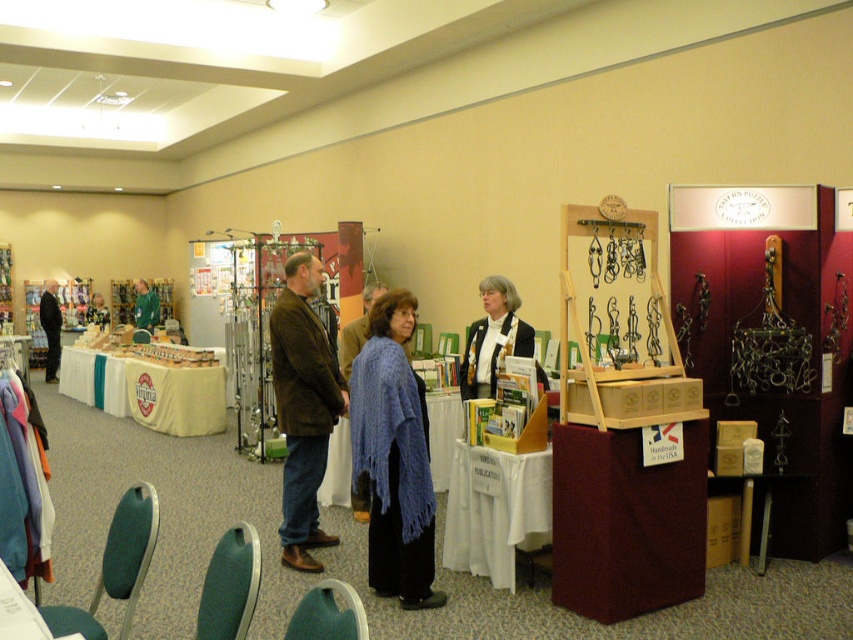
Is point (380, 449) in front of point (495, 346)?

That is True.

Does point (432, 513) come farther from viewer compared to point (531, 355)?

That is False.

Find the location of a particular element. The height and width of the screenshot is (640, 853). blue knitted shawl at center is located at coordinates (393, 456).

Where is `blue knitted shawl at center`? Image resolution: width=853 pixels, height=640 pixels. blue knitted shawl at center is located at coordinates (393, 456).

Is blue knitted shawl at center behind dark brown leather jacket at left?

No.

You are a GUI agent. You are given a task and a screenshot of the screen. Output one action in this format:
    pyautogui.click(x=<x>, y=<y>)
    Task: Click on the blue knitted shawl at center
    This screenshot has height=640, width=853.
    Given the screenshot: What is the action you would take?
    pyautogui.click(x=393, y=456)

Locate an element on the screen. blue knitted shawl at center is located at coordinates (393, 456).

Who is taller, brown leather jacket at center or dark brown leather jacket at left?

With more height is brown leather jacket at center.

Between brown leather jacket at center and dark brown leather jacket at left, which one has less height?

Standing shorter between the two is dark brown leather jacket at left.

Locate an element on the screen. The height and width of the screenshot is (640, 853). brown leather jacket at center is located at coordinates (303, 406).

Where is `brown leather jacket at center`? Image resolution: width=853 pixels, height=640 pixels. brown leather jacket at center is located at coordinates (303, 406).